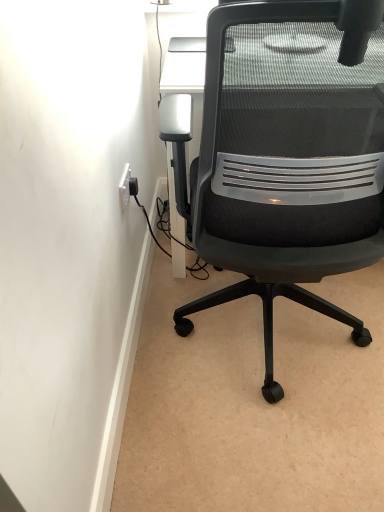
Question: Is white plastic electric outlet at upper left bigger than black mesh office chair at center?

Choices:
 (A) no
 (B) yes

Answer: (A)

Question: From the image's perspective, is white plastic electric outlet at upper left located beneath black mesh office chair at center?

Choices:
 (A) no
 (B) yes

Answer: (A)

Question: Can black mesh office chair at center be found inside white plastic electric outlet at upper left?

Choices:
 (A) no
 (B) yes

Answer: (A)

Question: Are white plastic electric outlet at upper left and black mesh office chair at center beside each other?

Choices:
 (A) no
 (B) yes

Answer: (A)

Question: Is white plastic electric outlet at upper left far away from black mesh office chair at center?

Choices:
 (A) yes
 (B) no

Answer: (B)

Question: Is white plastic electric outlet at upper left to the left of black mesh office chair at center from the viewer's perspective?

Choices:
 (A) yes
 (B) no

Answer: (A)

Question: Is black mesh office chair at center thinner than white plastic electric outlet at upper left?

Choices:
 (A) yes
 (B) no

Answer: (B)

Question: From a real-world perspective, is black mesh office chair at center beneath white plastic electric outlet at upper left?

Choices:
 (A) no
 (B) yes

Answer: (A)

Question: Can you confirm if black mesh office chair at center is wider than white plastic electric outlet at upper left?

Choices:
 (A) no
 (B) yes

Answer: (B)

Question: From the image's perspective, does black mesh office chair at center appear lower than white plastic electric outlet at upper left?

Choices:
 (A) yes
 (B) no

Answer: (A)

Question: Does black mesh office chair at center have a larger size compared to white plastic electric outlet at upper left?

Choices:
 (A) no
 (B) yes

Answer: (B)

Question: Is black mesh office chair at center to the left of white plastic electric outlet at upper left from the viewer's perspective?

Choices:
 (A) yes
 (B) no

Answer: (B)

Question: In terms of height, does black mesh office chair at center look taller or shorter compared to white plastic electric outlet at upper left?

Choices:
 (A) short
 (B) tall

Answer: (B)